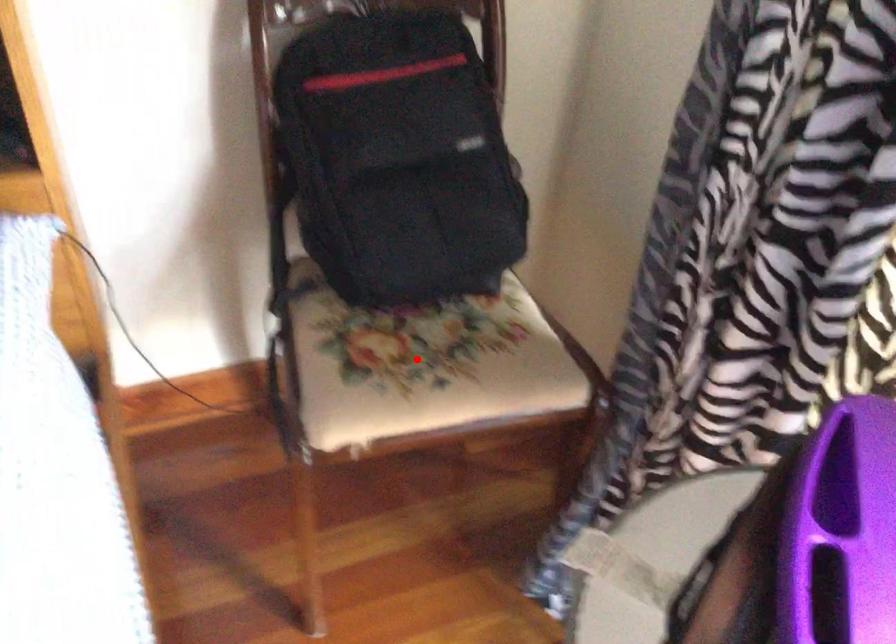
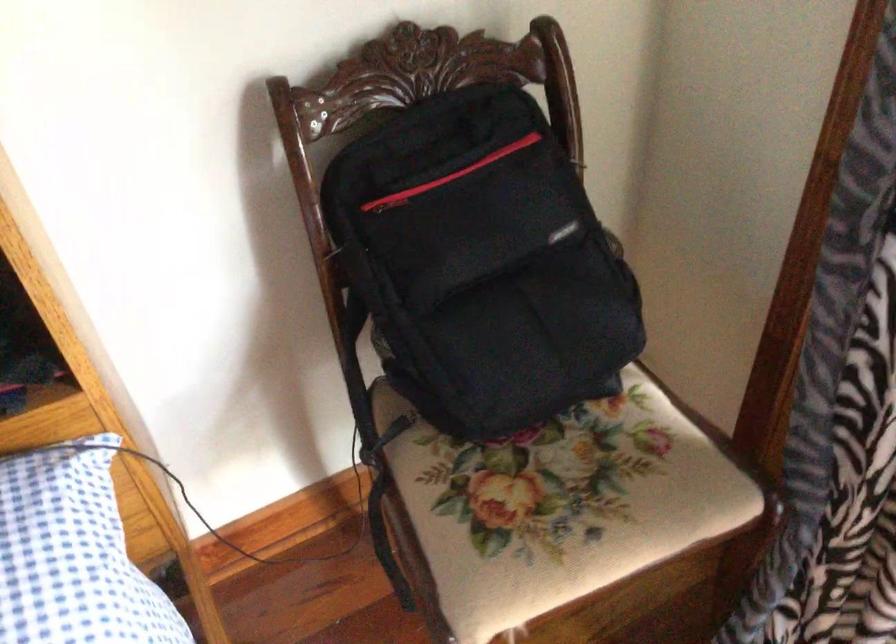
Question: A red point is marked in image1. In image2, is the corresponding 3D point closer to the camera or farther? Reply with the corresponding letter.

Choices:
 (A) The corresponding 3D point is closer.
 (B) The corresponding 3D point is farther.

Answer: (A)